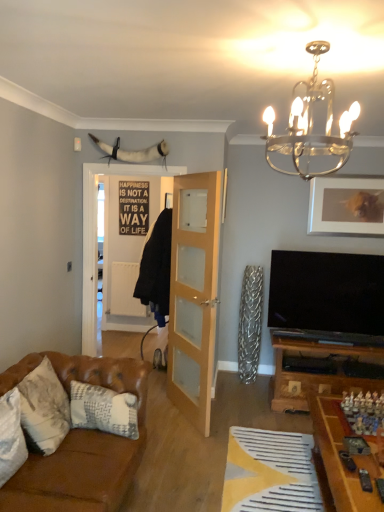
Question: Looking at their shapes, would you say yellow fabric at lower center is wider or thinner than clear glass door at center?

Choices:
 (A) wide
 (B) thin

Answer: (A)

Question: In the image, is yellow fabric at lower center positioned in front of or behind clear glass door at center?

Choices:
 (A) front
 (B) behind

Answer: (A)

Question: Which is farther from the white textured pillow at lower left, which appears as the 1th pillow when viewed from the front?

Choices:
 (A) wooden game board at lower right
 (B) white textured pillow at lower left, acting as the 1th pillow starting from the back
 (C) yellow fabric at lower center
 (D) metallic chandelier at upper center
 (E) black matte signboard at center

Answer: (E)

Question: Which object is positioned closest to the black matte signboard at center?

Choices:
 (A) metallic chandelier at upper center
 (B) wooden game board at lower right
 (C) clear glass door at center
 (D) leather pillow at left, which is counted as the 2th pillow, starting from the front
 (E) matte silver picture frame at upper right

Answer: (C)